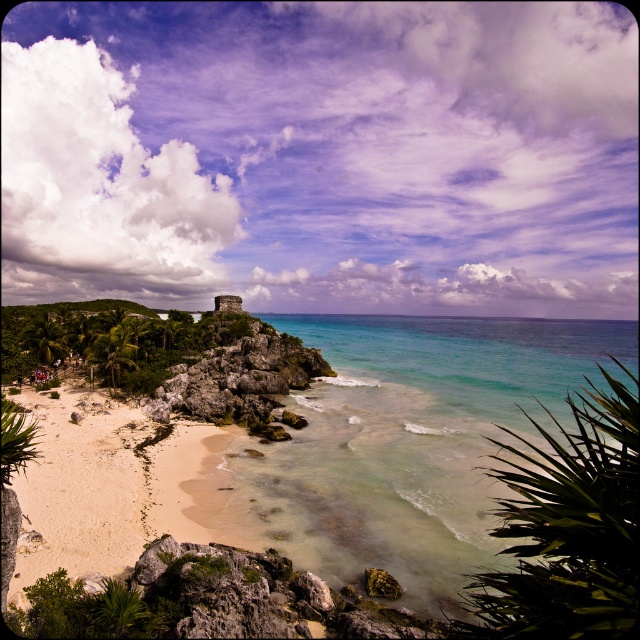
Question: Which point appears closest to the camera in this image?

Choices:
 (A) (522, 568)
 (B) (456, 512)
 (C) (129, 340)

Answer: (A)

Question: Which object appears closest to the camera in this image?

Choices:
 (A) green leafy palm tree at left
 (B) rockyrough stonerocky formation at center-left
 (C) clear glass water at center
 (D) green leafy palm tree at lower right

Answer: (D)

Question: In this image, where is clear glass water at center located relative to green leafy palm tree at lower right?

Choices:
 (A) left
 (B) right

Answer: (B)

Question: Estimate the real-world distances between objects in this image. Which object is farther from the green leafy palm tree at lower right?

Choices:
 (A) rockyrough stonerocky formation at center-left
 (B) clear glass water at center

Answer: (A)

Question: Can you confirm if green leafy palm tree at lower right is positioned above rockyrough stonerocky formation at center-left?

Choices:
 (A) yes
 (B) no

Answer: (B)

Question: Can you confirm if clear glass water at center is wider than green leafy palm tree at lower right?

Choices:
 (A) no
 (B) yes

Answer: (B)